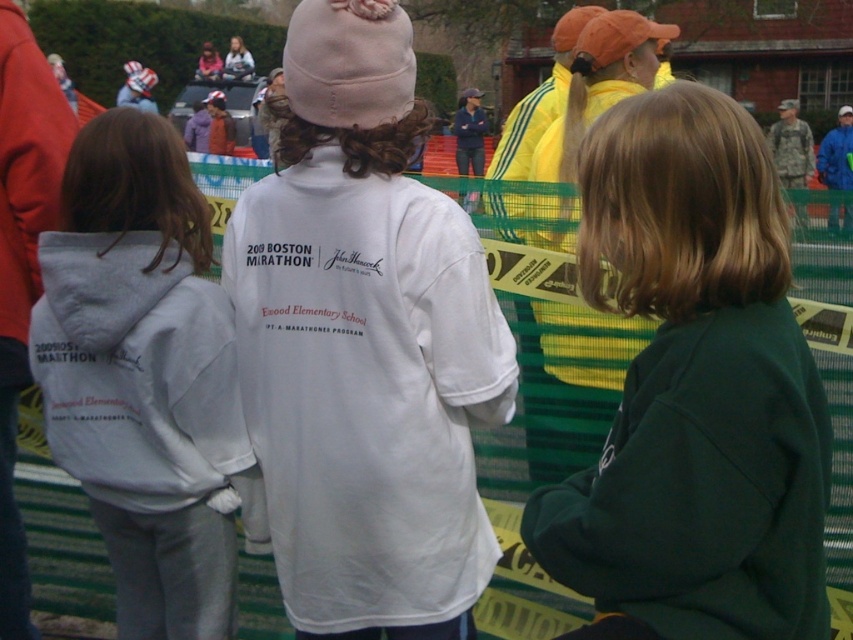
You are standing at the event and see the central figure wearing the marathon shirt and the point marked at coordinates (165,308). Which one is closer to you?

The point marked at coordinates (165,308) is closer to you since it is only 12.03 feet away, whereas the central figure is further back in the scene.

You are a photographer at the marathon event and need to capture both the dark green sweatshirt at center and the blue fabric jacket at upper right in a single shot. Which of the two is positioned closer to the camera?

Result: The dark green sweatshirt at center is closer to the viewer than the blue fabric jacket at upper right, so it will appear larger in the photo.

You are a photographer at the marathon event. You need to capture a photo of both the white cotton sweatshirt at center and the blue fabric jacket at upper right in the same frame. Which clothing item will appear taller in the photo?

The blue fabric jacket at upper right will appear taller in the photo because the white cotton sweatshirt at center is not as tall as the blue fabric jacket at upper right.